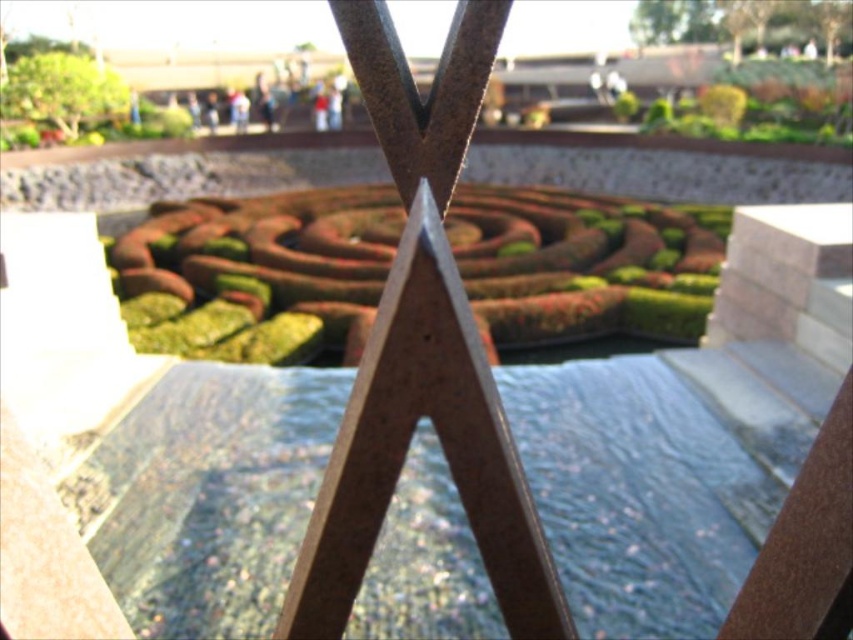
Question: Among these objects, which one is nearest to the camera?

Choices:
 (A) clear glass water at center
 (B) green mossy hedge at center
 (C) green textured hedge at upper left

Answer: (A)

Question: Can you confirm if clear glass water at center is bigger than green textured hedge at upper left?

Choices:
 (A) yes
 (B) no

Answer: (B)

Question: Considering the relative positions of clear glass water at center and green textured hedge at upper left in the image provided, where is clear glass water at center located with respect to green textured hedge at upper left?

Choices:
 (A) right
 (B) left

Answer: (A)

Question: Estimate the real-world distances between objects in this image. Which object is farther from the clear glass water at center?

Choices:
 (A) green mossy hedge at center
 (B) green textured hedge at upper left

Answer: (B)

Question: Which object is farther from the camera taking this photo?

Choices:
 (A) clear glass water at center
 (B) green textured hedge at upper left

Answer: (B)

Question: Is clear glass water at center closer to the viewer compared to green textured hedge at upper left?

Choices:
 (A) no
 (B) yes

Answer: (B)